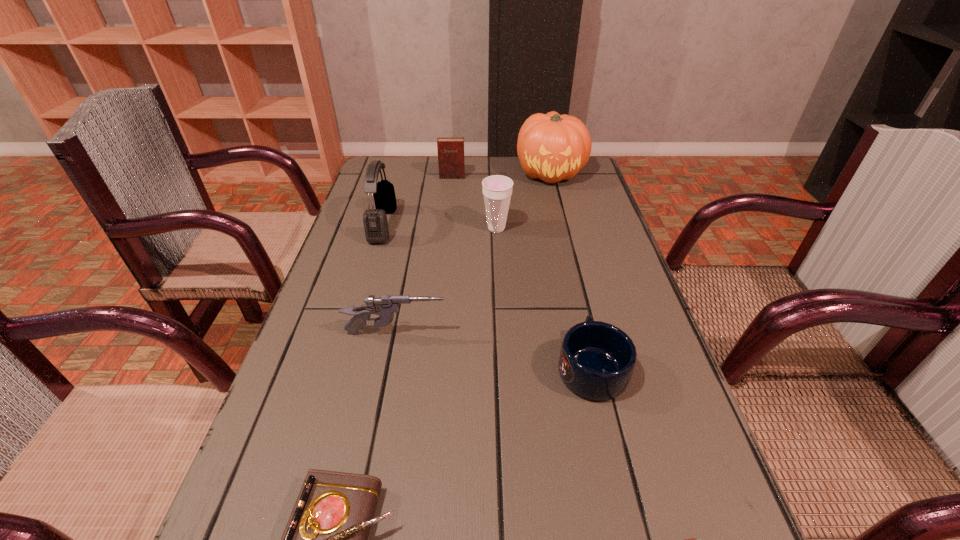
This screenshot has width=960, height=540. In order to click on vacant space located at the barrel of the fourth shortest object in this screenshot , I will do `click(470, 334)`.

The width and height of the screenshot is (960, 540). I want to click on vacant space located with the handle on the side of the sixth tallest object, so [566, 260].

At what (x,y) coordinates should I click in order to perform the action: click on free space located with the handle on the side of the sixth tallest object. Please return your answer as a coordinate pair (x, y). Looking at the image, I should click on (564, 248).

I want to click on free space located with the handle on the side of the sixth tallest object, so click(x=572, y=287).

Locate an element on the screen. The image size is (960, 540). pumpkin located in the far edge section of the desktop is located at coordinates (552, 147).

Find the location of `diary that is at the far edge`. diary that is at the far edge is located at coordinates (451, 164).

At what (x,y) coordinates should I click in order to perform the action: click on headset that is at the left edge. Please return your answer as a coordinate pair (x, y). Looking at the image, I should click on (375, 222).

Where is `gun positioned at the left edge`? gun positioned at the left edge is located at coordinates (385, 306).

Image resolution: width=960 pixels, height=540 pixels. I want to click on pumpkin present at the right edge, so click(552, 147).

Where is `mug at the right edge`? mug at the right edge is located at coordinates (597, 359).